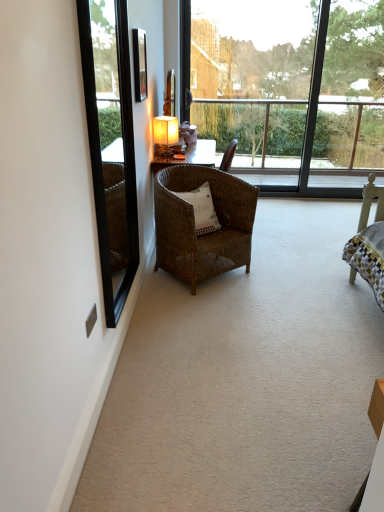
Question: Considering the relative positions of matte yellow lampshade at center and black glass mirror at left in the image provided, is matte yellow lampshade at center to the right of black glass mirror at left from the viewer's perspective?

Choices:
 (A) no
 (B) yes

Answer: (B)

Question: From a real-world perspective, is matte yellow lampshade at center beneath black glass mirror at left?

Choices:
 (A) yes
 (B) no

Answer: (A)

Question: Is matte yellow lampshade at center bigger than black glass mirror at left?

Choices:
 (A) no
 (B) yes

Answer: (A)

Question: Does matte yellow lampshade at center have a lesser width compared to black glass mirror at left?

Choices:
 (A) no
 (B) yes

Answer: (A)

Question: Does matte yellow lampshade at center come behind black glass mirror at left?

Choices:
 (A) no
 (B) yes

Answer: (B)

Question: Is matte yellow lampshade at center at the left side of black glass mirror at left?

Choices:
 (A) no
 (B) yes

Answer: (A)

Question: Does white woven pillow at center come behind matte yellow lampshade at center?

Choices:
 (A) yes
 (B) no

Answer: (B)

Question: Is white woven pillow at center oriented away from matte yellow lampshade at center?

Choices:
 (A) no
 (B) yes

Answer: (A)

Question: Does white woven pillow at center have a lesser height compared to matte yellow lampshade at center?

Choices:
 (A) yes
 (B) no

Answer: (A)

Question: From the image's perspective, is white woven pillow at center above matte yellow lampshade at center?

Choices:
 (A) no
 (B) yes

Answer: (A)

Question: Does white woven pillow at center have a smaller size compared to matte yellow lampshade at center?

Choices:
 (A) no
 (B) yes

Answer: (A)

Question: Can you confirm if white woven pillow at center is wider than matte yellow lampshade at center?

Choices:
 (A) yes
 (B) no

Answer: (A)

Question: Considering the relative sizes of woven brown chair at center and matte black picture frame at upper center in the image provided, is woven brown chair at center wider than matte black picture frame at upper center?

Choices:
 (A) yes
 (B) no

Answer: (A)